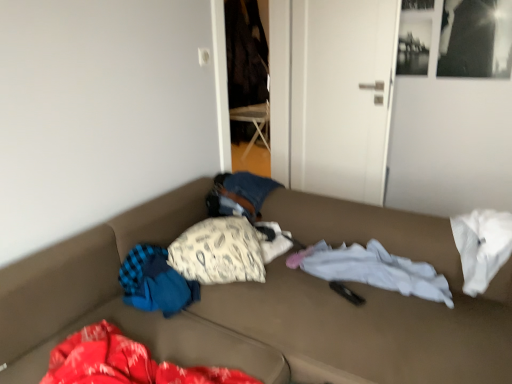
Question: Does white fabric pillow at center have a lesser width compared to brown fabric couch at center?

Choices:
 (A) yes
 (B) no

Answer: (A)

Question: Considering the relative positions of white fabric pillow at center and brown fabric couch at center in the image provided, is white fabric pillow at center behind brown fabric couch at center?

Choices:
 (A) no
 (B) yes

Answer: (B)

Question: Can you confirm if white fabric pillow at center is shorter than brown fabric couch at center?

Choices:
 (A) yes
 (B) no

Answer: (A)

Question: Are white fabric pillow at center and brown fabric couch at center beside each other?

Choices:
 (A) yes
 (B) no

Answer: (B)

Question: From a real-world perspective, is white fabric pillow at center on brown fabric couch at center?

Choices:
 (A) yes
 (B) no

Answer: (A)

Question: Can you confirm if white fabric pillow at center is positioned to the left of brown fabric couch at center?

Choices:
 (A) yes
 (B) no

Answer: (A)

Question: Is the position of white matte door at center more distant than that of brown fabric couch at center?

Choices:
 (A) yes
 (B) no

Answer: (A)

Question: Considering the relative positions of white matte door at center and brown fabric couch at center in the image provided, is white matte door at center to the right of brown fabric couch at center from the viewer's perspective?

Choices:
 (A) no
 (B) yes

Answer: (B)

Question: Does white matte door at center have a lesser width compared to brown fabric couch at center?

Choices:
 (A) no
 (B) yes

Answer: (B)

Question: Can you confirm if white matte door at center is shorter than brown fabric couch at center?

Choices:
 (A) no
 (B) yes

Answer: (A)

Question: From the image's perspective, is white matte door at center below brown fabric couch at center?

Choices:
 (A) yes
 (B) no

Answer: (B)

Question: Does white matte door at center have a greater width compared to brown fabric couch at center?

Choices:
 (A) no
 (B) yes

Answer: (A)

Question: Can you confirm if brown fabric couch at center is positioned to the left of white matte door at center?

Choices:
 (A) yes
 (B) no

Answer: (A)